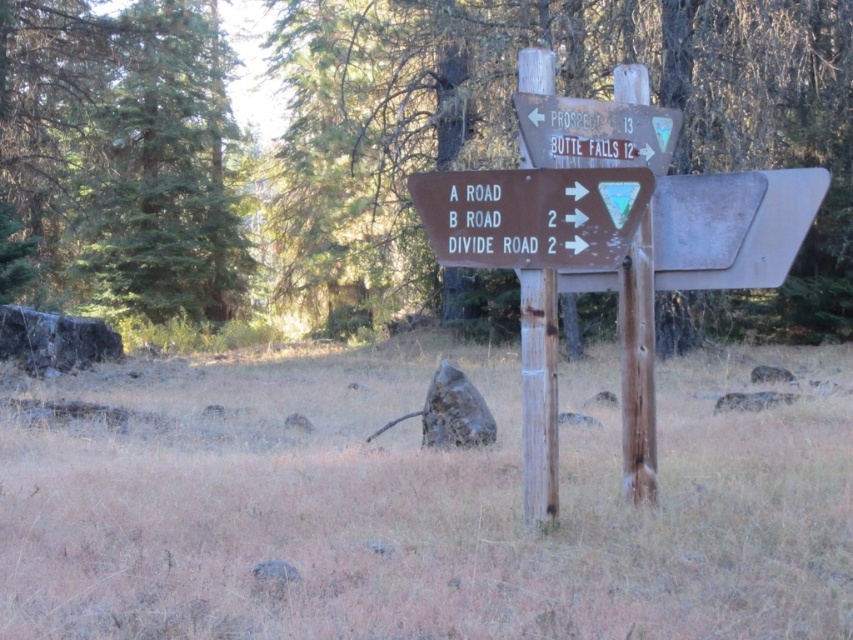
You are standing in front of a signpost in a forest. You see a brown wooden sign at center and a wooden sign at upper center. Which one is wider?

The brown wooden sign at center is wider than the wooden sign at upper center.

You are standing in front of a signpost in a forest. You see a brown wood sign at center and a brown wooden sign at center. Which one is to the right of the other?

The brown wood sign at center is to the right of brown wooden sign at center.